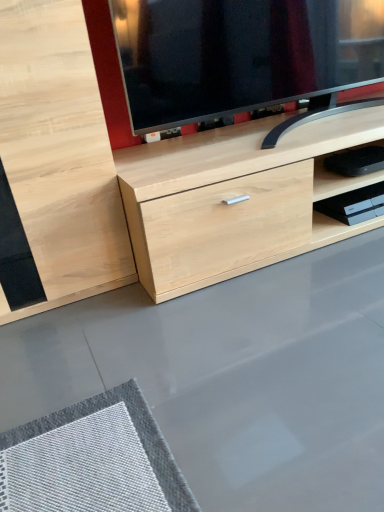
Question: Can you confirm if black plastic device at lower right is shorter than black plastic shelf at lower right?

Choices:
 (A) yes
 (B) no

Answer: (B)

Question: From a real-world perspective, does black plastic device at lower right sit lower than black plastic shelf at lower right?

Choices:
 (A) yes
 (B) no

Answer: (B)

Question: Considering the relative positions of black plastic device at lower right and black plastic shelf at lower right in the image provided, is black plastic device at lower right behind black plastic shelf at lower right?

Choices:
 (A) yes
 (B) no

Answer: (B)

Question: From the image's perspective, is black plastic device at lower right below black plastic shelf at lower right?

Choices:
 (A) no
 (B) yes

Answer: (A)

Question: Does black plastic device at lower right contain black plastic shelf at lower right?

Choices:
 (A) yes
 (B) no

Answer: (B)

Question: Can you see black plastic device at lower right touching black plastic shelf at lower right?

Choices:
 (A) yes
 (B) no

Answer: (B)

Question: Considering the relative sizes of black plastic shelf at lower right and black plastic device at lower right in the image provided, is black plastic shelf at lower right wider than black plastic device at lower right?

Choices:
 (A) yes
 (B) no

Answer: (B)

Question: Does black plastic shelf at lower right have a lesser height compared to black plastic device at lower right?

Choices:
 (A) no
 (B) yes

Answer: (B)

Question: Can you confirm if black plastic shelf at lower right is positioned to the left of black plastic device at lower right?

Choices:
 (A) yes
 (B) no

Answer: (B)

Question: From a real-world perspective, does black plastic shelf at lower right stand above black plastic device at lower right?

Choices:
 (A) no
 (B) yes

Answer: (A)

Question: Can you confirm if black plastic shelf at lower right is taller than black plastic device at lower right?

Choices:
 (A) yes
 (B) no

Answer: (B)

Question: Is black plastic shelf at lower right further to the viewer compared to black plastic device at lower right?

Choices:
 (A) yes
 (B) no

Answer: (A)

Question: Considering their positions, is black plastic device at lower right located in front of or behind black plastic shelf at lower right?

Choices:
 (A) front
 (B) behind

Answer: (A)